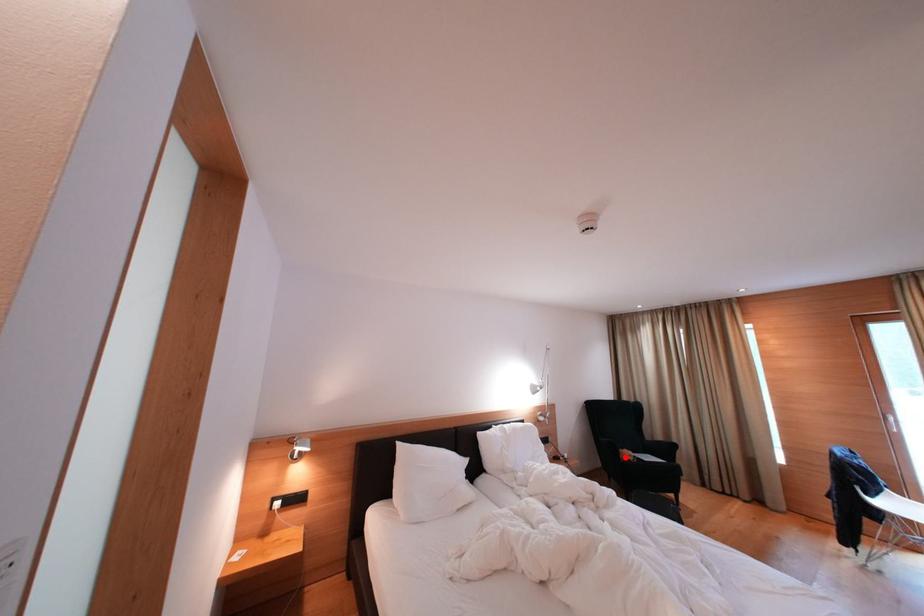
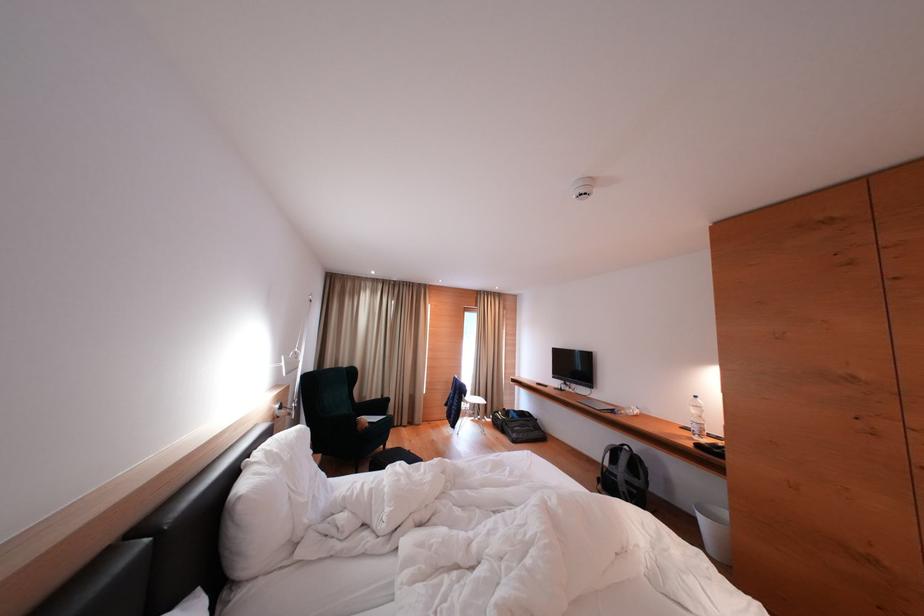
Where in the second image is the point corresponding to the highlighted location from the first image?

(362, 428)